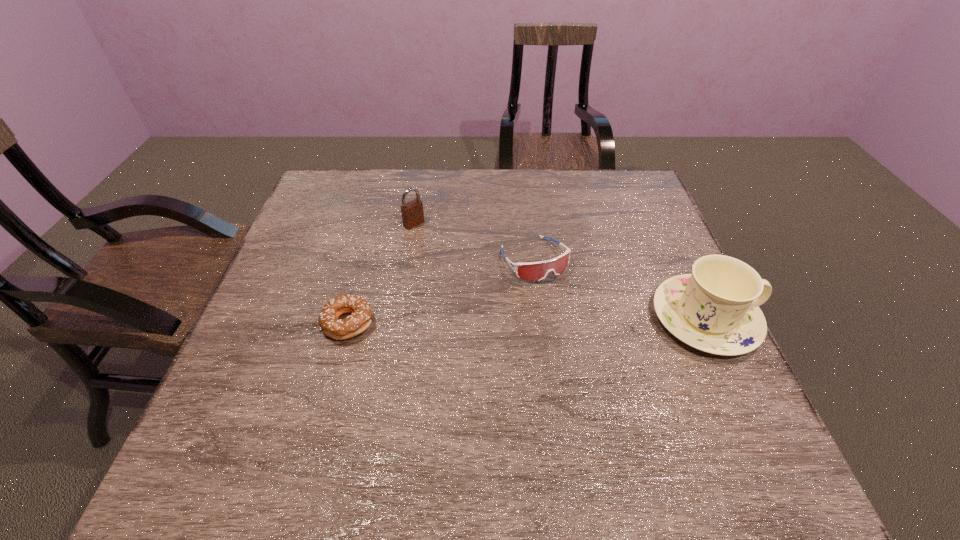
Find the location of `the leftmost object`. the leftmost object is located at coordinates (340, 329).

Identify the location of the shortest object. This screenshot has width=960, height=540. (340, 329).

The height and width of the screenshot is (540, 960). Identify the location of chinaware. (715, 309).

You are a GUI agent. You are given a task and a screenshot of the screen. Output one action in this format:
    pyautogui.click(x=<x>, y=<y>)
    Task: Click on the second object from left to right
    The image size is (960, 540).
    Given the screenshot: What is the action you would take?
    pyautogui.click(x=412, y=212)

Identify the location of the farthest object. This screenshot has height=540, width=960. (412, 212).

Locate an element on the screen. This screenshot has height=540, width=960. the second shortest object is located at coordinates 534,271.

Locate an element on the screen. the third object from left to right is located at coordinates (534, 271).

At what (x,y) coordinates should I click in order to perform the action: click on free spot located 0.320m on the right of the leftmost object. Please return your answer as a coordinate pair (x, y). The width and height of the screenshot is (960, 540). Looking at the image, I should click on (515, 323).

You are a GUI agent. You are given a task and a screenshot of the screen. Output one action in this format:
    pyautogui.click(x=<x>, y=<y>)
    Task: Click on the vacant space positioned on the front-facing side of the farthest object
    The image size is (960, 540).
    Given the screenshot: What is the action you would take?
    pyautogui.click(x=497, y=290)

In order to click on vacant space located on the front-facing side of the farthest object in this screenshot , I will do `click(463, 262)`.